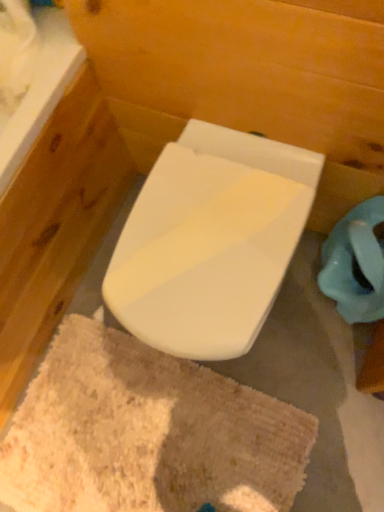
This screenshot has width=384, height=512. In order to click on blank space situated above beige shaggy bath mat at center (from a real-world perspective) in this screenshot , I will do `click(125, 429)`.